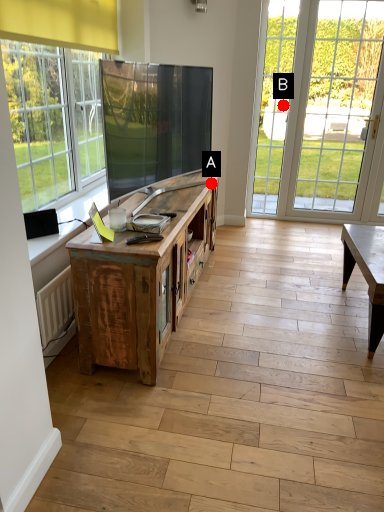
Question: Two points are circled on the image, labeled by A and B beside each circle. Which point is closer to the camera taking this photo?

Choices:
 (A) A is closer
 (B) B is closer

Answer: (A)